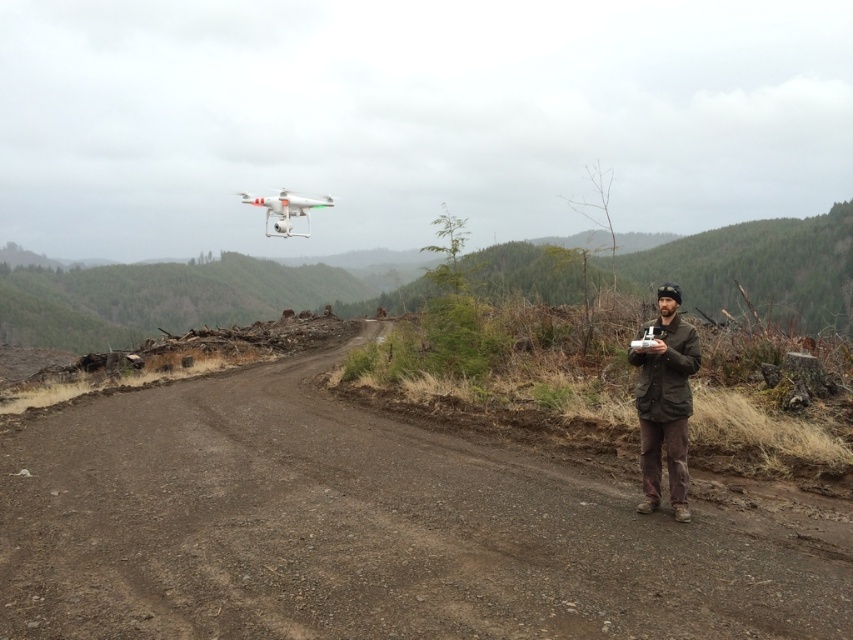
From the picture: You are a hiker lost in the forest and see the brown woolen jacket at right and the white matte drone at upper center. Which object is higher up in the image?

The white matte drone at upper center is higher up in the image than the brown woolen jacket at right.

You are a hiker who wants to follow the brown dirt track at center using the white matte drone at upper center for guidance. Can the drone fit within the track without overlapping its edges?

The brown dirt track at center has a smaller size compared to white matte drone at upper center, so the drone is larger than the track. This means the drone cannot fit within the track without overlapping its edges.

You are a hiker trying to navigate through the forest using a map. You notice two points marked on your map corresponding to coordinates in the image. The first point is at point [9,442] and the second is at point [647,385]. Which point is closer to your current position as you stand on the dirt road?

Point [9,442] is closer to your current position because it is further to the viewer compared to point [647,385], which is located further away in the background.